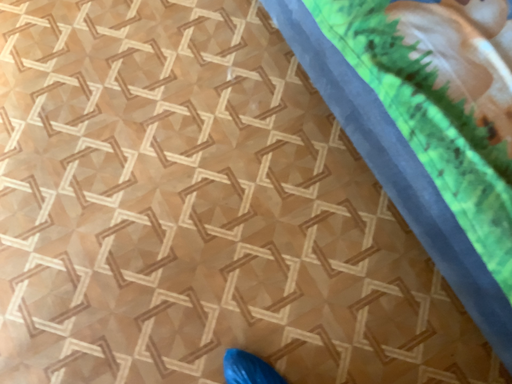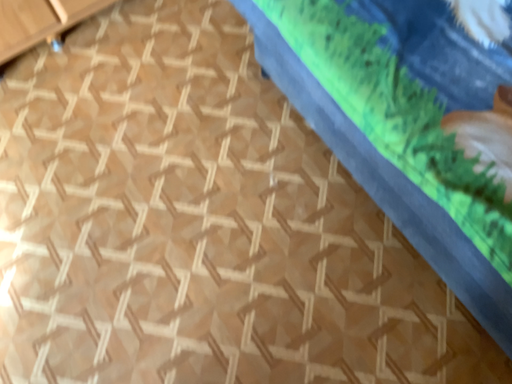
Question: Which way did the camera rotate in the video?

Choices:
 (A) rotated upward
 (B) rotated downward

Answer: (A)